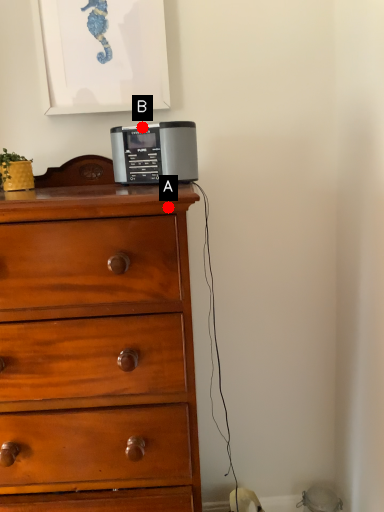
Question: Two points are circled on the image, labeled by A and B beside each circle. Among these points, which one is farthest from the camera?

Choices:
 (A) A is further
 (B) B is further

Answer: (B)